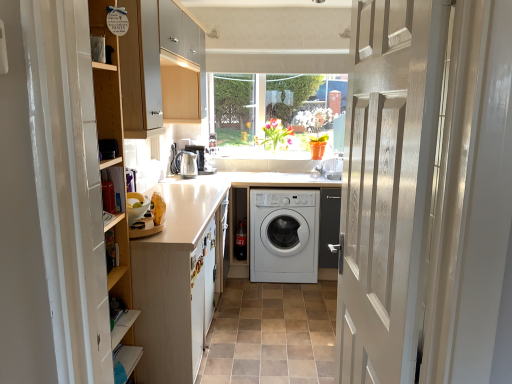
Identify the location of empty space that is ontop of white matte washer at center (from a real-world perspective). (284, 328).